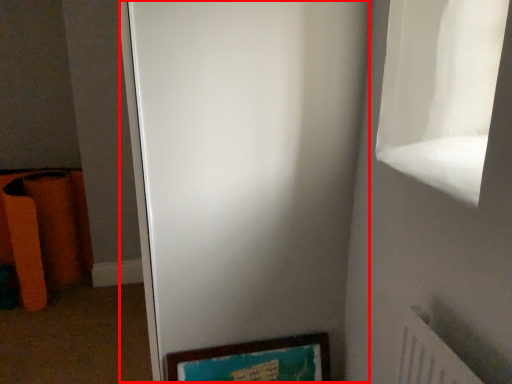
Question: In this image, where is screen door (annotated by the red box) located relative to picture frame?

Choices:
 (A) right
 (B) left

Answer: (B)